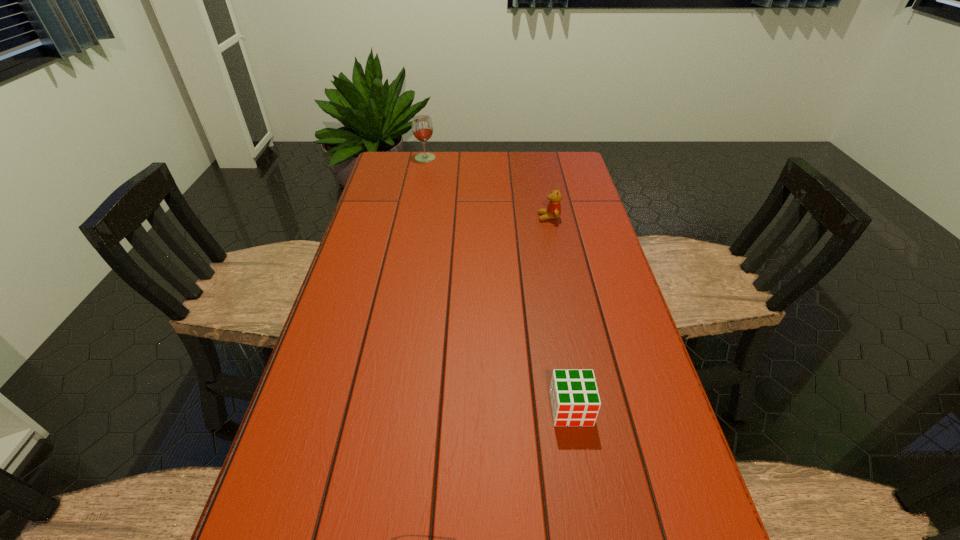
At what (x,y) coordinates should I click in order to perform the action: click on the leftmost object. Please return your answer as a coordinate pair (x, y). Image resolution: width=960 pixels, height=540 pixels. Looking at the image, I should click on (422, 128).

I want to click on the farthest object, so click(422, 128).

In order to click on teddy bear in this screenshot , I will do `click(553, 211)`.

I want to click on the second tallest object, so click(x=553, y=211).

Locate an element on the screen. cube is located at coordinates (575, 401).

Identify the location of the nearest object. (575, 401).

You are a GUI agent. You are given a task and a screenshot of the screen. Output one action in this format:
    pyautogui.click(x=<x>, y=<y>)
    Task: Click on the free space located 0.300m on the front of the wineglass
    
    Given the screenshot: What is the action you would take?
    pyautogui.click(x=416, y=205)

Where is `vacant region located on the front-facing side of the teddy bear`? This screenshot has width=960, height=540. vacant region located on the front-facing side of the teddy bear is located at coordinates (433, 217).

This screenshot has width=960, height=540. Identify the location of vacant space located 0.100m on the front-facing side of the teddy bear. (507, 217).

The width and height of the screenshot is (960, 540). I want to click on vacant space situated 0.240m on the front-facing side of the teddy bear, so click(x=464, y=217).